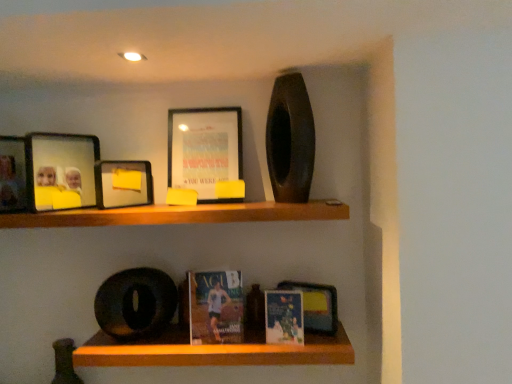
What is the approximate height of matte paperback book at center, the first paperback book from the left?

The height of matte paperback book at center, the first paperback book from the left, is 11.87 inches.

Image resolution: width=512 pixels, height=384 pixels. Describe the element at coordinates (123, 183) in the screenshot. I see `matte plastic picture frame at upper left, the second picture frame viewed from the right` at that location.

The height and width of the screenshot is (384, 512). Describe the element at coordinates (205, 150) in the screenshot. I see `matte black picture frame at upper center, the fourth picture frame from the left` at that location.

This screenshot has width=512, height=384. Describe the element at coordinates (61, 170) in the screenshot. I see `matte glass photo frame at upper left, positioned as the 3th picture frame in right-to-left order` at that location.

The height and width of the screenshot is (384, 512). Identify the location of matte paper book at center, the second paperback book when ordered from left to right. (284, 317).

What are the coordinates of `matte paperback book at center, the first paperback book from the left` in the screenshot? It's located at (215, 307).

Is matte paperback book at center, which ranks as the second paperback book in right-to-left order, facing away from wooden shelf at upper center, placed as the 2th shelf when sorted from bottom to top?

No, wooden shelf at upper center, placed as the 2th shelf when sorted from bottom to top, is not at the back of matte paperback book at center, which ranks as the second paperback book in right-to-left order.

In the scene shown: Between matte paperback book at center, the first paperback book from the left, and wooden shelf at upper center, placed as the 2th shelf when sorted from bottom to top, which one has smaller size?

matte paperback book at center, the first paperback book from the left, is smaller.

Can you tell me how much matte paperback book at center, the first paperback book from the left, and wooden shelf at upper center, placed as the 2th shelf when sorted from bottom to top, differ in facing direction?

matte paperback book at center, the first paperback book from the left, and wooden shelf at upper center, placed as the 2th shelf when sorted from bottom to top, are facing 5.8 degrees away from each other.

Does wooden shelf at upper center, placed as the 2th shelf when sorted from bottom to top, have a greater width compared to matte paperback book at center, the first paperback book from the left?

Yes, wooden shelf at upper center, placed as the 2th shelf when sorted from bottom to top, is wider than matte paperback book at center, the first paperback book from the left.

Is wooden shelf at upper center, arranged as the first shelf when viewed from the top, inside the boundaries of matte paperback book at center, the first paperback book from the left, or outside?

wooden shelf at upper center, arranged as the first shelf when viewed from the top, is not inside matte paperback book at center, the first paperback book from the left, it's outside.

Based on the photo, is wooden shelf at upper center, placed as the 2th shelf when sorted from bottom to top, looking in the opposite direction of matte paperback book at center, the first paperback book from the left?

No, wooden shelf at upper center, placed as the 2th shelf when sorted from bottom to top, is not facing away from matte paperback book at center, the first paperback book from the left.

Between wooden shelf at upper center, placed as the 2th shelf when sorted from bottom to top, and matte paperback book at center, which ranks as the second paperback book in right-to-left order, which one has smaller size?

matte paperback book at center, which ranks as the second paperback book in right-to-left order, is smaller.

Is matte plastic picture frame at upper left, the second picture frame viewed from the right, looking in the opposite direction of matte paper book at center?

matte plastic picture frame at upper left, the second picture frame viewed from the right, is not turned away from matte paper book at center.

Is matte plastic picture frame at upper left, the second picture frame viewed from the right, bigger than matte paper book at center?

Correct, matte plastic picture frame at upper left, the second picture frame viewed from the right, is larger in size than matte paper book at center.

Can you confirm if matte plastic picture frame at upper left, arranged as the third picture frame when viewed from the left, is taller than matte paper book at center?

No, matte plastic picture frame at upper left, arranged as the third picture frame when viewed from the left, is not taller than matte paper book at center.

Identify the location of book cover lying below the matte plastic picture frame at upper left, the second picture frame viewed from the right (from the image's perspective). The height and width of the screenshot is (384, 512). (316, 305).

From the image's perspective, is wooden shelf at upper center, placed as the 2th shelf when sorted from bottom to top, below wooden shelf at lower center, which is the first shelf from bottom to top?

No, from the image's perspective, wooden shelf at upper center, placed as the 2th shelf when sorted from bottom to top, is not below wooden shelf at lower center, which is the first shelf from bottom to top.

Between wooden shelf at upper center, placed as the 2th shelf when sorted from bottom to top, and wooden shelf at lower center, placed as the 2th shelf when sorted from top to bottom, which one has larger size?

wooden shelf at upper center, placed as the 2th shelf when sorted from bottom to top.

How far apart are wooden shelf at upper center, arranged as the first shelf when viewed from the top, and wooden shelf at lower center, placed as the 2th shelf when sorted from top to bottom?

A distance of 19.90 inches exists between wooden shelf at upper center, arranged as the first shelf when viewed from the top, and wooden shelf at lower center, placed as the 2th shelf when sorted from top to bottom.

Does point (265, 207) appear closer or farther from the camera than point (326, 364)?

Point (265, 207) is closer to the camera than point (326, 364).

Do you think matte plastic picture frame at upper left, the second picture frame viewed from the right, is within matte paperback book at center, the first paperback book from the left, or outside of it?

matte plastic picture frame at upper left, the second picture frame viewed from the right, exists outside the volume of matte paperback book at center, the first paperback book from the left.

From the image's perspective, which one is positioned higher, matte plastic picture frame at upper left, the second picture frame viewed from the right, or matte paperback book at center, which ranks as the second paperback book in right-to-left order?

matte plastic picture frame at upper left, the second picture frame viewed from the right.

Which object is further away from the camera, matte plastic picture frame at upper left, arranged as the third picture frame when viewed from the left, or matte paperback book at center, the first paperback book from the left?

Positioned behind is matte plastic picture frame at upper left, arranged as the third picture frame when viewed from the left.

Starting from the matte plastic picture frame at upper left, the second picture frame viewed from the right, which paperback book is the 1st one in front? Please provide its 2D coordinates.

[(215, 307)]

I want to click on shelf that is on the left side of matte black picture frame at upper center, the 1th picture frame viewed from the right, so click(x=179, y=215).

Is matte black picture frame at upper center, the 1th picture frame viewed from the right, bigger than wooden shelf at upper center, arranged as the first shelf when viewed from the top?

Incorrect, matte black picture frame at upper center, the 1th picture frame viewed from the right, is not larger than wooden shelf at upper center, arranged as the first shelf when viewed from the top.

Are matte black picture frame at upper center, the fourth picture frame from the left, and wooden shelf at upper center, placed as the 2th shelf when sorted from bottom to top, making contact?

No, matte black picture frame at upper center, the fourth picture frame from the left, is not beside wooden shelf at upper center, placed as the 2th shelf when sorted from bottom to top.

From a real-world perspective, is matte black picture frame at upper center, the 1th picture frame viewed from the right, over wooden shelf at upper center, placed as the 2th shelf when sorted from bottom to top?

Correct, in the physical world, matte black picture frame at upper center, the 1th picture frame viewed from the right, is higher than wooden shelf at upper center, placed as the 2th shelf when sorted from bottom to top.

From the picture: Is the depth of matte black picture frame at upper center, the 1th picture frame viewed from the right, less than that of matte black picture frame at upper left, marked as the 4th picture frame in a right-to-left arrangement?

That is False.

Are matte black picture frame at upper center, the 1th picture frame viewed from the right, and matte black picture frame at upper left, which is the first picture frame from left to right, beside each other?

No, matte black picture frame at upper center, the 1th picture frame viewed from the right, is not touching matte black picture frame at upper left, which is the first picture frame from left to right.

Where is `the 2nd picture frame behind when counting from the matte black picture frame at upper left, marked as the 4th picture frame in a right-to-left arrangement`? the 2nd picture frame behind when counting from the matte black picture frame at upper left, marked as the 4th picture frame in a right-to-left arrangement is located at coordinates (205, 150).

Find the location of a particular element. This screenshot has width=512, height=384. shelf that is the 2nd one when counting leftward from the matte paperback book at center, the first paperback book from the left is located at coordinates (179, 215).

What are the coordinates of `the 2nd paperback book behind the wooden shelf at upper center, placed as the 2th shelf when sorted from bottom to top, counting from the anchor's position` in the screenshot? It's located at [x=215, y=307].

When comparing their distances from matte glass photo frame at upper left, positioned as the 3th picture frame in right-to-left order, does matte paper book at center, acting as the first paperback book starting from the right, or matte black picture frame at upper left, marked as the 4th picture frame in a right-to-left arrangement, seem further?

The object further to matte glass photo frame at upper left, positioned as the 3th picture frame in right-to-left order, is matte paper book at center, acting as the first paperback book starting from the right.

Based on their spatial positions, is wooden shelf at upper center, placed as the 2th shelf when sorted from bottom to top, or matte paper book at center, the second paperback book when ordered from left to right, further from matte black picture frame at upper left, marked as the 4th picture frame in a right-to-left arrangement?

The object further to matte black picture frame at upper left, marked as the 4th picture frame in a right-to-left arrangement, is matte paper book at center, the second paperback book when ordered from left to right.

When comparing their distances from matte plastic picture frame at upper left, arranged as the third picture frame when viewed from the left, does matte paper book at center or matte black picture frame at upper center, the fourth picture frame from the left, seem closer?

matte black picture frame at upper center, the fourth picture frame from the left, is closer to matte plastic picture frame at upper left, arranged as the third picture frame when viewed from the left.

Considering their positions, is matte plastic picture frame at upper left, arranged as the third picture frame when viewed from the left, positioned closer to matte black picture frame at upper left, marked as the 4th picture frame in a right-to-left arrangement, than wooden shelf at lower center, which is the first shelf from bottom to top?

matte plastic picture frame at upper left, arranged as the third picture frame when viewed from the left, lies closer to matte black picture frame at upper left, marked as the 4th picture frame in a right-to-left arrangement, than the other object.

Considering their positions, is matte paperback book at center, the first paperback book from the left, positioned further to wooden shelf at lower center, which is the first shelf from bottom to top, than matte paper book at center?

Among the two, matte paper book at center is located further to wooden shelf at lower center, which is the first shelf from bottom to top.

Based on their spatial positions, is matte black picture frame at upper center, the fourth picture frame from the left, or matte plastic picture frame at upper left, arranged as the third picture frame when viewed from the left, closer to wooden shelf at upper center, placed as the 2th shelf when sorted from bottom to top?

matte plastic picture frame at upper left, arranged as the third picture frame when viewed from the left, is positioned closer to the anchor wooden shelf at upper center, placed as the 2th shelf when sorted from bottom to top.

In the scene shown: Considering their positions, is matte paper book at center positioned closer to matte paperback book at center, the first paperback book from the left, than wooden shelf at upper center, placed as the 2th shelf when sorted from bottom to top?

matte paper book at center is closer to matte paperback book at center, the first paperback book from the left.

Based on their spatial positions, is matte black picture frame at upper left, which is the first picture frame from left to right, or matte black picture frame at upper center, the 1th picture frame viewed from the right, closer to matte glass photo frame at upper left, positioned as the 3th picture frame in right-to-left order?

Among the two, matte black picture frame at upper left, which is the first picture frame from left to right, is located nearer to matte glass photo frame at upper left, positioned as the 3th picture frame in right-to-left order.

Find the location of a particular element. The width and height of the screenshot is (512, 384). picture frame between matte plastic picture frame at upper left, the second picture frame viewed from the right, and matte paper book at center is located at coordinates (205, 150).

Locate an element on the screen. The image size is (512, 384). paperback book between matte black picture frame at upper center, the 1th picture frame viewed from the right, and matte paper book at center, acting as the first paperback book starting from the right, from top to bottom is located at coordinates (215, 307).

Locate an element on the screen. This screenshot has height=384, width=512. picture frame located between matte glass photo frame at upper left, positioned as the 3th picture frame in right-to-left order, and matte black picture frame at upper center, the 1th picture frame viewed from the right, in the left-right direction is located at coordinates (123, 183).

The width and height of the screenshot is (512, 384). Identify the location of paperback book between matte paperback book at center, which ranks as the second paperback book in right-to-left order, and matte paper book at center. (284, 317).